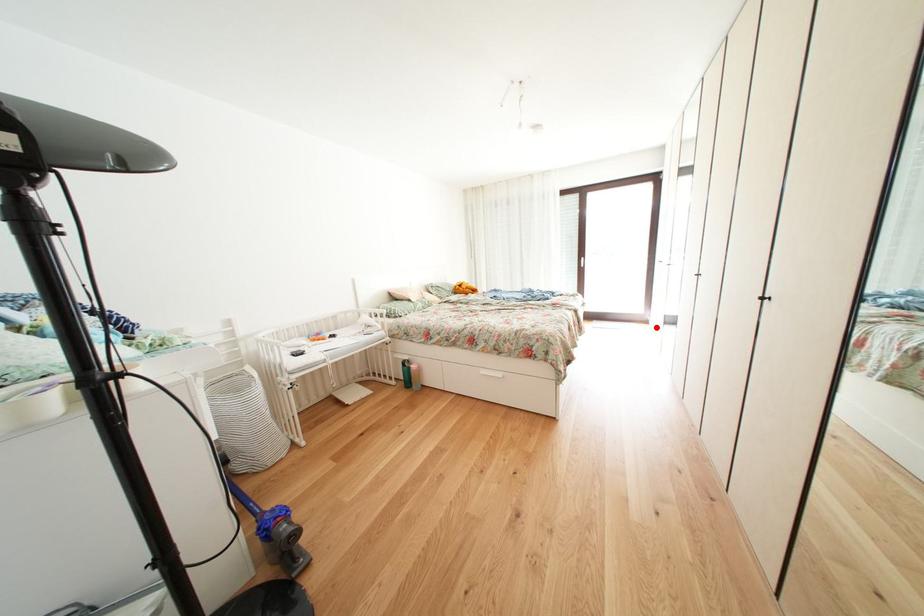
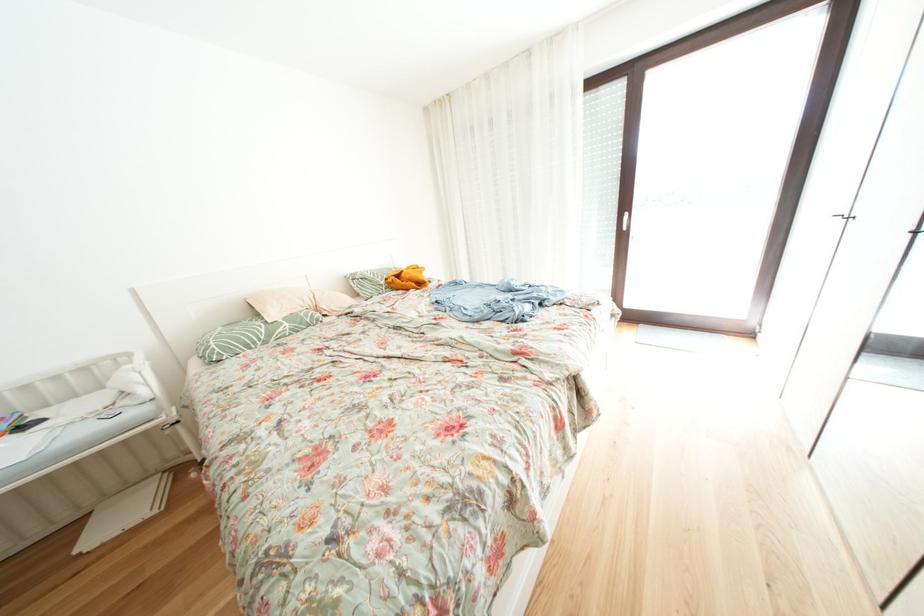
Where in the second image is the point corresponding to the highlighted location from the first image?

(759, 339)